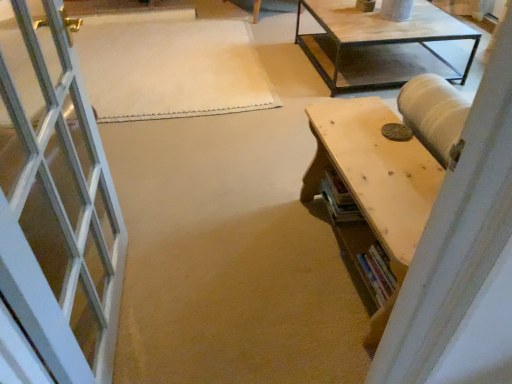
The image size is (512, 384). In order to click on empty space that is ontop of white woven mat at center (from a real-world perspective) in this screenshot , I will do `click(161, 48)`.